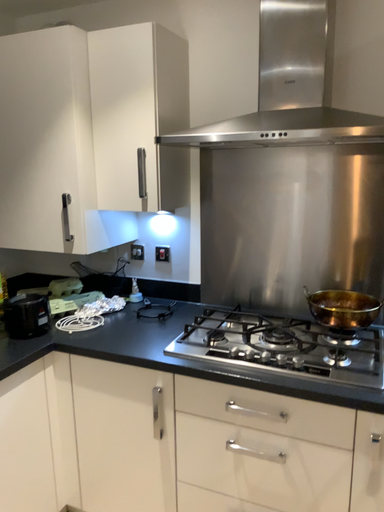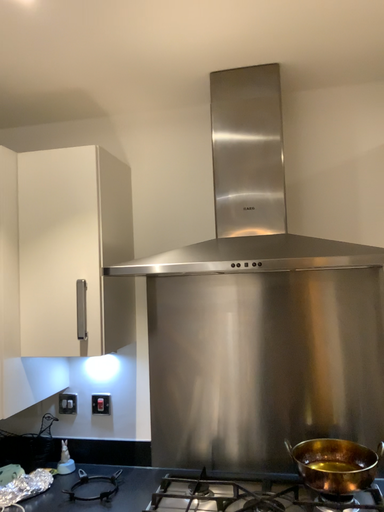
Question: Which way did the camera rotate in the video?

Choices:
 (A) rotated left
 (B) rotated right

Answer: (B)